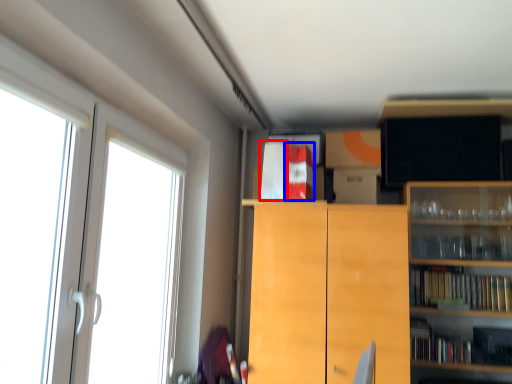
Question: Which of the following is the farthest to the observer, book (highlighted by a red box) or book (highlighted by a blue box)?

Choices:
 (A) book
 (B) book

Answer: (A)